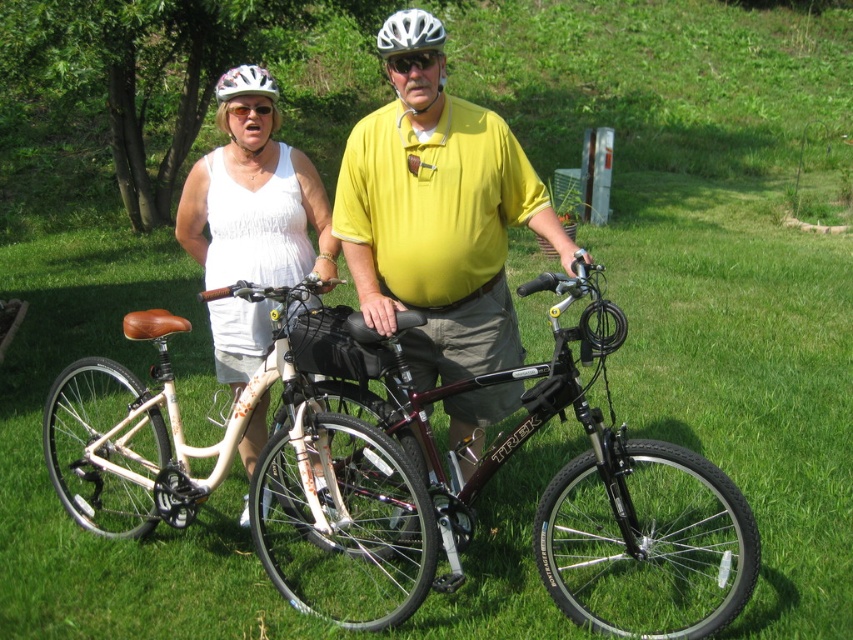
Question: Is white matte bicycle helmet at upper center positioned in front of white matte helmet at upper center?

Choices:
 (A) yes
 (B) no

Answer: (A)

Question: Where is white matte helmet at center located in relation to white matte helmet at upper center in the image?

Choices:
 (A) left
 (B) right

Answer: (B)

Question: Is white matte tank top at upper left bigger than white matte bicycle helmet at upper center?

Choices:
 (A) no
 (B) yes

Answer: (A)

Question: Which point is closer to the camera?

Choices:
 (A) white matte bicycle helmet at upper center
 (B) white glossy bicycle helmet at upper center
 (C) white matte tank top at upper left
 (D) matte yellow shirt at center

Answer: (D)

Question: Which point is closer to the camera taking this photo?

Choices:
 (A) (357, 360)
 (B) (222, 108)
 (C) (318, 211)

Answer: (A)

Question: Which point is closer to the camera taking this photo?

Choices:
 (A) (248, 93)
 (B) (334, 609)

Answer: (B)